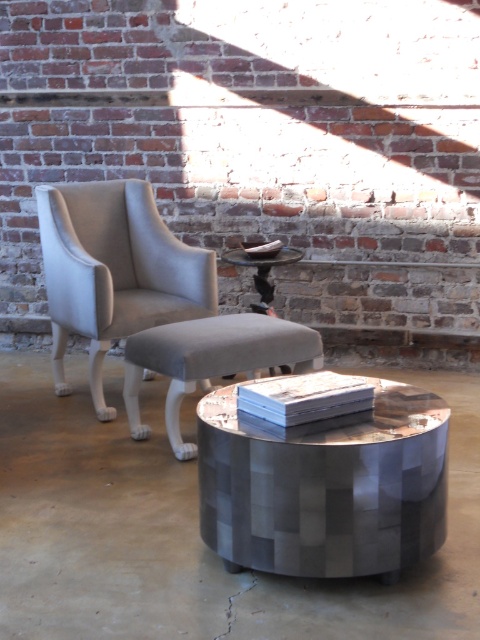
Which of these two, metallic mosaic table at center or light gray fabric armchair at center, stands shorter?

Standing shorter between the two is metallic mosaic table at center.

Does metallic mosaic table at center appear on the right side of light gray fabric armchair at center?

Correct, you'll find metallic mosaic table at center to the right of light gray fabric armchair at center.

Does point (310, 568) come in front of point (90, 204)?

Yes, point (310, 568) is in front of point (90, 204).

I want to click on metallic mosaic table at center, so click(x=324, y=484).

Which is more to the right, metallic mosaic table at center or matte gray stool at center?

From the viewer's perspective, metallic mosaic table at center appears more on the right side.

Does metallic mosaic table at center appear over matte gray stool at center?

No, metallic mosaic table at center is not above matte gray stool at center.

Who is more forward, (360, 560) or (224, 356)?

Point (360, 560)

Identify the location of metallic mosaic table at center. (324, 484).

Does light gray fabric armchair at center come behind matte gray stool at center?

That is True.

Is point (154, 230) more distant than point (184, 371)?

Yes, it is.

Find the location of a particular element. The width and height of the screenshot is (480, 640). light gray fabric armchair at center is located at coordinates (115, 269).

Locate an element on the screen. light gray fabric armchair at center is located at coordinates (115, 269).